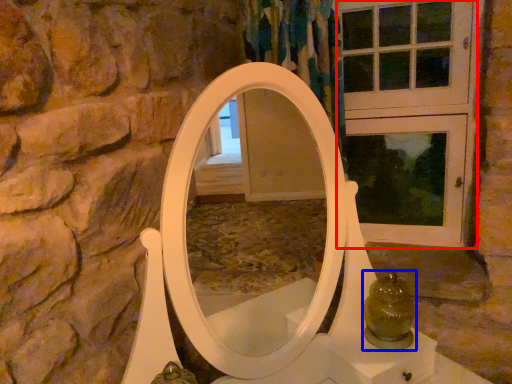
Question: Among these objects, which one is farthest to the camera, screen door (highlighted by a red box) or glass jar (highlighted by a blue box)?

Choices:
 (A) screen door
 (B) glass jar

Answer: (A)